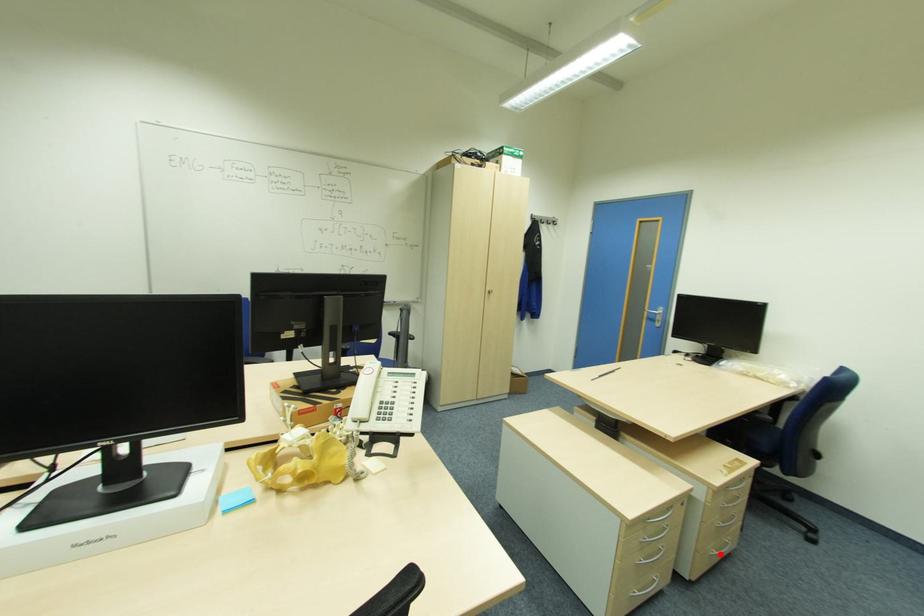
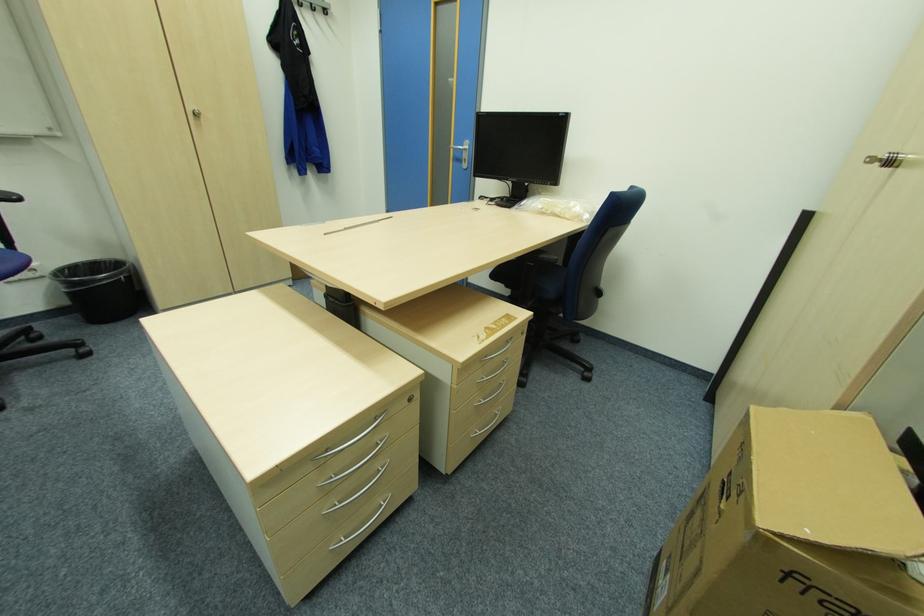
Find the pixel in the second image that matches the highlighted location in the first image.

(482, 432)